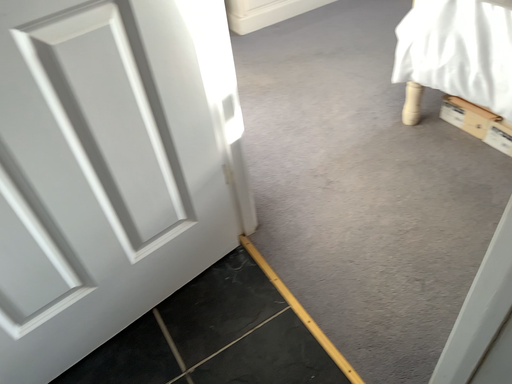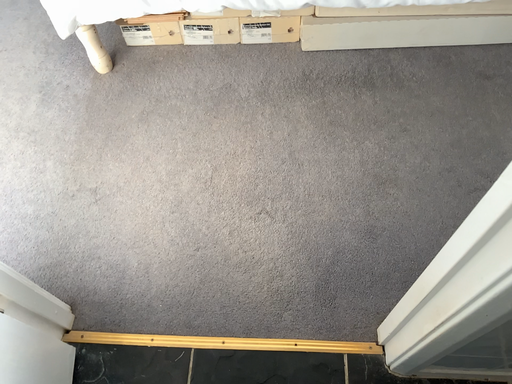
Question: How did the camera likely rotate when shooting the video?

Choices:
 (A) rotated right
 (B) rotated left

Answer: (A)